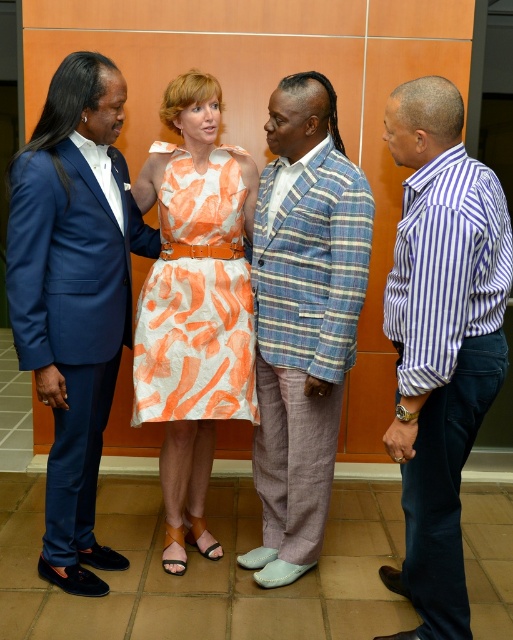
Question: Does matte blue suit at left appear over orange printed fabric dress at center?

Choices:
 (A) no
 (B) yes

Answer: (A)

Question: Among these objects, which one is farthest from the camera?

Choices:
 (A) purple striped shirt at right
 (B) orange printed fabric dress at center
 (C) plaid fabric blazer at center

Answer: (B)

Question: Is purple striped shirt at right in front of orange printed fabric dress at center?

Choices:
 (A) yes
 (B) no

Answer: (A)

Question: Is matte blue suit at left to the left of orange printed fabric dress at center from the viewer's perspective?

Choices:
 (A) no
 (B) yes

Answer: (B)

Question: Which object appears farthest from the camera in this image?

Choices:
 (A) purple striped shirt at right
 (B) orange printed fabric dress at center
 (C) plaid fabric blazer at center
 (D) matte blue suit at left

Answer: (B)

Question: Estimate the real-world distances between objects in this image. Which object is farther from the orange printed fabric dress at center?

Choices:
 (A) purple striped shirt at right
 (B) plaid fabric blazer at center
 (C) matte blue suit at left

Answer: (A)